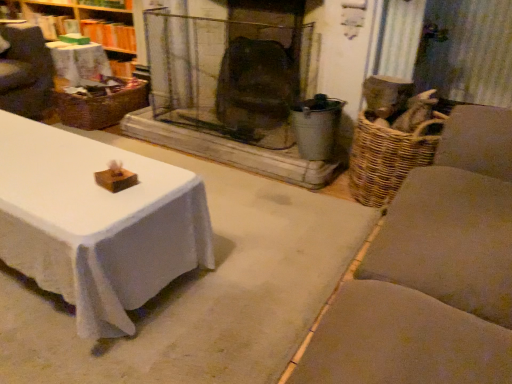
What do you see at coordinates (86, 28) in the screenshot? The width and height of the screenshot is (512, 384). I see `wooden wicker basket at upper left` at bounding box center [86, 28].

Locate an element on the screen. The height and width of the screenshot is (384, 512). wooden wicker basket at upper left is located at coordinates (86, 28).

Describe the element at coordinates (101, 104) in the screenshot. The width and height of the screenshot is (512, 384). I see `woven brown basket at left` at that location.

You are a GUI agent. You are given a task and a screenshot of the screen. Output one action in this format:
    pyautogui.click(x=<x>, y=<y>)
    Task: Click on the woven brown basket at left
    
    Given the screenshot: What is the action you would take?
    pyautogui.click(x=101, y=104)

Where is `wooden wicker basket at upper left`? The image size is (512, 384). wooden wicker basket at upper left is located at coordinates (86, 28).

Considering the positions of objects woven brown basket at left and wooden wicker basket at upper left in the image provided, who is more to the right, woven brown basket at left or wooden wicker basket at upper left?

woven brown basket at left.

From the picture: Is woven brown basket at left behind wooden wicker basket at upper left?

No, it is not.

Does point (59, 109) come in front of point (115, 66)?

Yes, point (59, 109) is closer to viewer.

From the image's perspective, between woven brown basket at left and wooden wicker basket at upper left, who is located below?

woven brown basket at left appears lower in the image.

In the scene shown: From a real-world perspective, is woven brown basket at left physically located above or below wooden wicker basket at upper left?

woven brown basket at left is below wooden wicker basket at upper left.

Based on the photo, which of these two, woven brown basket at left or wooden wicker basket at upper left, is thinner?

With smaller width is wooden wicker basket at upper left.

Can you confirm if woven brown basket at left is taller than wooden wicker basket at upper left?

No.

Which of these two, woven brown basket at left or wooden wicker basket at upper left, is bigger?

wooden wicker basket at upper left.

Is woven brown basket at left inside or outside of wooden wicker basket at upper left?

woven brown basket at left is spatially situated outside wooden wicker basket at upper left.

Is woven brown basket at left with wooden wicker basket at upper left?

No, woven brown basket at left is not next to wooden wicker basket at upper left.

Does woven brown basket at left turn towards wooden wicker basket at upper left?

No.

Can you tell me how much woven brown basket at left and wooden wicker basket at upper left differ in facing direction?

2.11 degrees separate the facing orientations of woven brown basket at left and wooden wicker basket at upper left.

Measure the distance from woven brown basket at left to wooden wicker basket at upper left.

woven brown basket at left is 57.81 centimeters from wooden wicker basket at upper left.

In order to click on basket on the right side of wooden wicker basket at upper left in this screenshot , I will do `click(101, 104)`.

Visually, is wooden wicker basket at upper left positioned to the left or to the right of woven brown basket at left?

wooden wicker basket at upper left is positioned on woven brown basket at left's left side.

Consider the image. Is wooden wicker basket at upper left closer to the viewer compared to woven brown basket at left?

No, it is not.

Which is in front, point (121, 68) or point (101, 98)?

The point (101, 98) is closer to the camera.

Based on the photo, from the image's perspective, is wooden wicker basket at upper left under woven brown basket at left?

No.

From a real-world perspective, is wooden wicker basket at upper left on woven brown basket at left?

Correct, in the physical world, wooden wicker basket at upper left is higher than woven brown basket at left.

Which of these two, wooden wicker basket at upper left or woven brown basket at left, is thinner?

wooden wicker basket at upper left.

Considering the sizes of objects wooden wicker basket at upper left and woven brown basket at left in the image provided, who is shorter, wooden wicker basket at upper left or woven brown basket at left?

woven brown basket at left.

Considering the sizes of objects wooden wicker basket at upper left and woven brown basket at left in the image provided, who is smaller, wooden wicker basket at upper left or woven brown basket at left?

woven brown basket at left is smaller.

Would you say wooden wicker basket at upper left is outside woven brown basket at left?

Yes.

Would you say wooden wicker basket at upper left is a long distance from woven brown basket at left?

They are positioned close to each other.

Is wooden wicker basket at upper left turned away from woven brown basket at left?

No.

How distant is wooden wicker basket at upper left from woven brown basket at left?

wooden wicker basket at upper left and woven brown basket at left are 22.76 inches apart from each other.

You are a GUI agent. You are given a task and a screenshot of the screen. Output one action in this format:
    pyautogui.click(x=<x>, y=<y>)
    Task: Click on the basket below the wooden wicker basket at upper left (from the image's perspective)
    This screenshot has height=384, width=512.
    Given the screenshot: What is the action you would take?
    pyautogui.click(x=101, y=104)

Locate an element on the screen. Image resolution: width=512 pixels, height=384 pixels. basket on the right of the wooden wicker basket at upper left is located at coordinates (101, 104).

Identify the location of basket directly beneath the wooden wicker basket at upper left (from a real-world perspective). This screenshot has height=384, width=512. (101, 104).